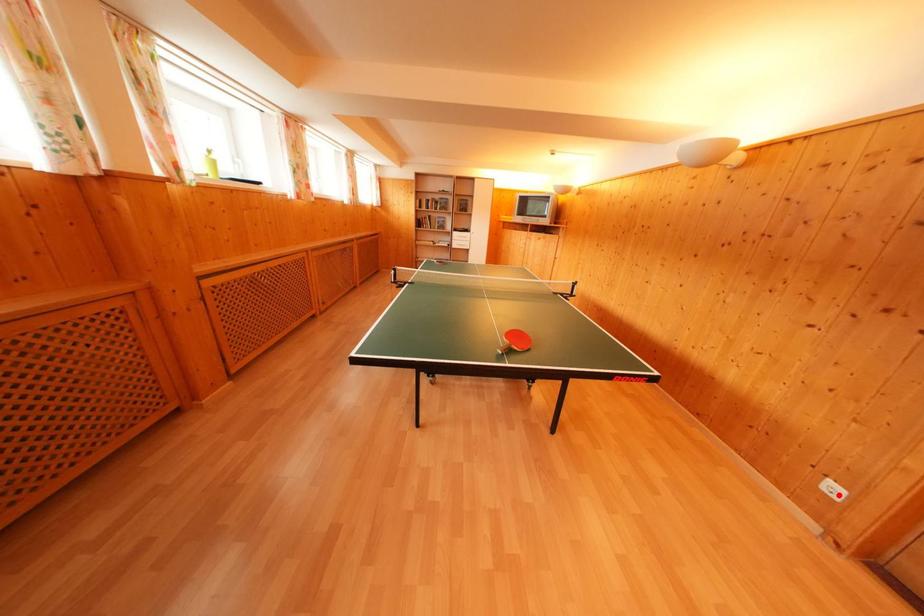
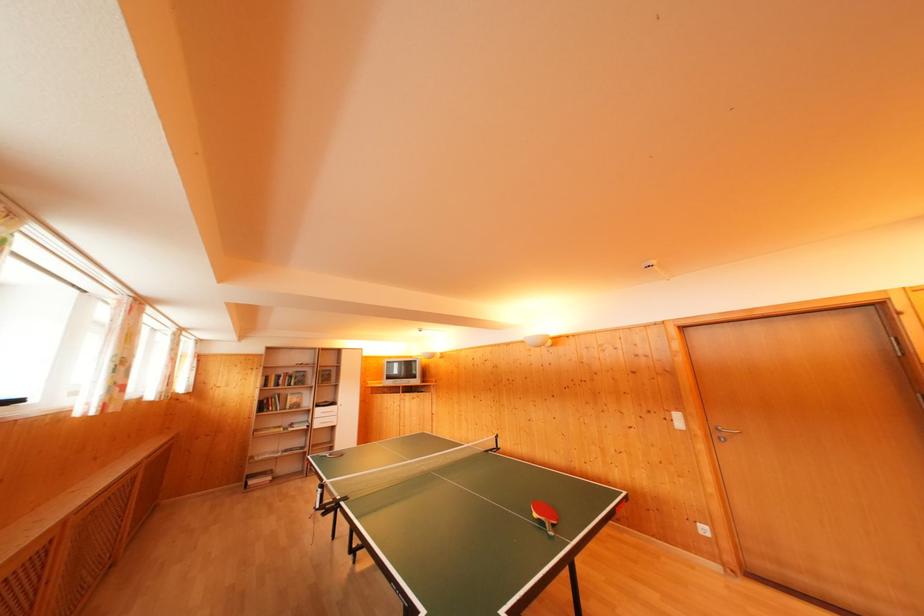
Question: A red point is marked in image1. In image2, is the corresponding 3D point closer to the camera or farther? Reply with the corresponding letter.

Choices:
 (A) The corresponding 3D point is closer.
 (B) The corresponding 3D point is farther.

Answer: (A)